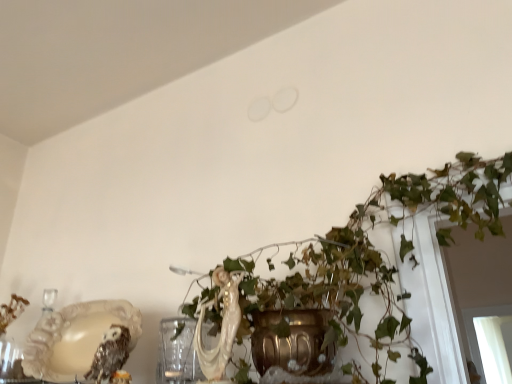
Question: From a real-world perspective, is white glossy cat at center physically located above or below shiny metallic owl at lower left?

Choices:
 (A) below
 (B) above

Answer: (B)

Question: Is point (231, 292) positioned closer to the camera than point (106, 332)?

Choices:
 (A) closer
 (B) farther

Answer: (A)

Question: Based on their relative distances, which object is farther from the green leafy plant at center?

Choices:
 (A) shiny metallic owl at lower left
 (B) white glossy cat at center

Answer: (A)

Question: Estimate the real-world distances between objects in this image. Which object is closer to the white glossy cat at center?

Choices:
 (A) green leafy plant at center
 (B) shiny metallic owl at lower left

Answer: (B)